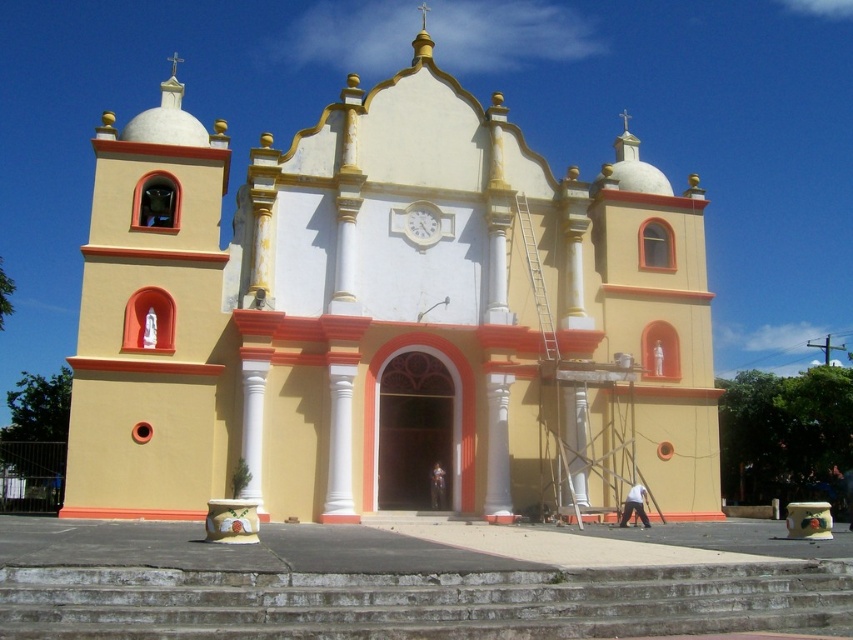
You are standing at the base of the concrete stairs at center leading up to the yellow matte church at center. If you look up, which structure will appear larger in your field of view?

The yellow matte church at center will appear larger in your field of view because it is taller than the concrete stairs at center.

You are standing in a park and see the yellow matte church at center in the distance. If you want to take a photo of the church with your smartphone, where should you position yourself relative to the church to ensure it fits perfectly in the frame?

Since the yellow matte church at center is located at coordinates approximately 0.498 on the x and 0.455 on the y axis, positioning yourself directly in front of the church, centered along its facade, would ensure the entire structure fits within the frame.

You are standing at the entrance of the yellow matte church at center and want to go down the concrete stairs at center. Which direction should you walk to reach the stairs?

The yellow matte church at center is to the left of the concrete stairs at center, so you should walk to the right to reach the stairs.